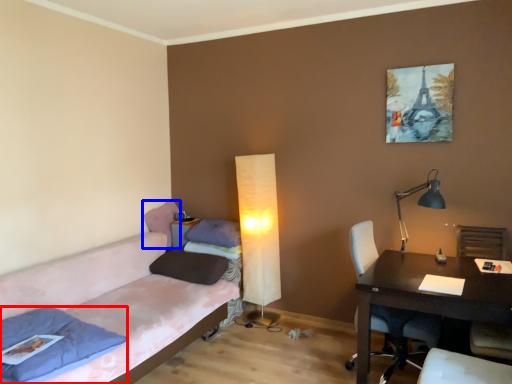
Question: Which object is closer to the camera taking this photo, pillow (highlighted by a red box) or pillow (highlighted by a blue box)?

Choices:
 (A) pillow
 (B) pillow

Answer: (A)